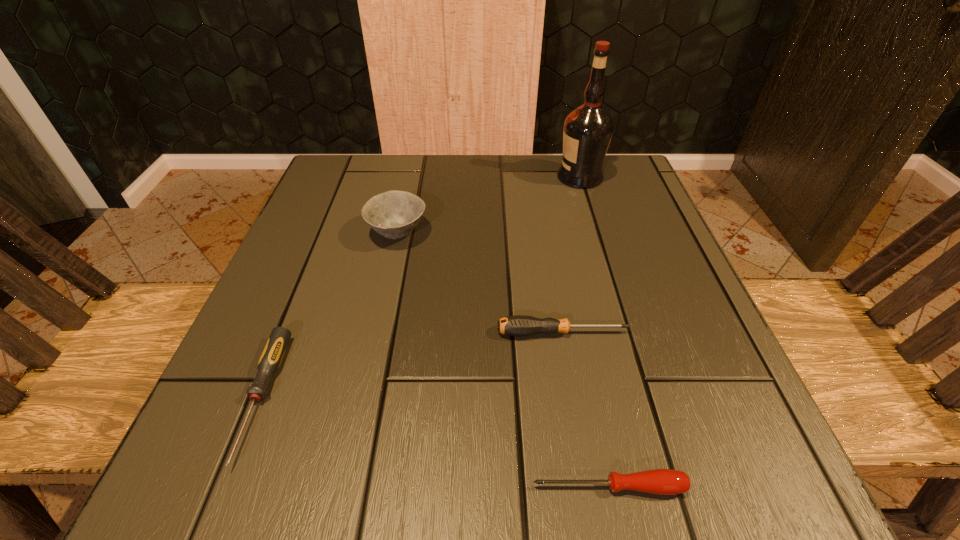
I want to click on the tallest object, so click(588, 129).

Where is `liquor`? This screenshot has width=960, height=540. liquor is located at coordinates (588, 129).

Identify the location of bowl. This screenshot has width=960, height=540. (394, 214).

I want to click on the fourth nearest object, so click(x=394, y=214).

This screenshot has width=960, height=540. Identify the location of the leftmost object. (270, 360).

Image resolution: width=960 pixels, height=540 pixels. Identify the location of the nearest object. (657, 481).

The width and height of the screenshot is (960, 540). What are the coordinates of `vacant position located on the surface of the tallest object` in the screenshot? It's located at (403, 177).

The height and width of the screenshot is (540, 960). I want to click on vacant space situated 0.280m on the surface of the tallest object, so click(x=438, y=177).

The width and height of the screenshot is (960, 540). In order to click on vacant space situated on the surface of the tallest object in this screenshot , I will do `click(399, 177)`.

This screenshot has width=960, height=540. What are the coordinates of `free space located on the right of the bowl` in the screenshot? It's located at (542, 233).